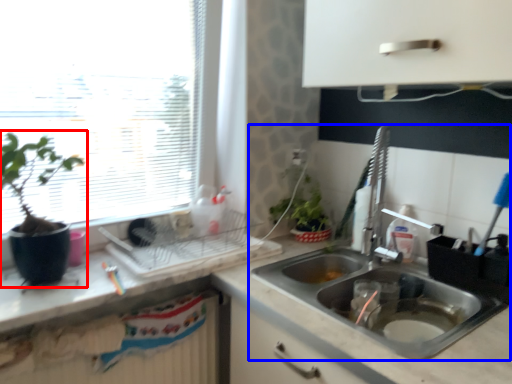
Question: Among these objects, which one is nearest to the camera, houseplant (highlighted by a red box) or sink (highlighted by a blue box)?

Choices:
 (A) houseplant
 (B) sink

Answer: (A)